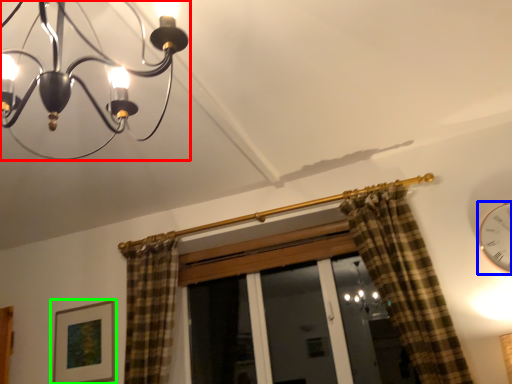
Question: Which is nearer to the lamp (highlighted by a red box)? clock (highlighted by a blue box) or picture frame (highlighted by a green box).

Choices:
 (A) clock
 (B) picture frame

Answer: (B)